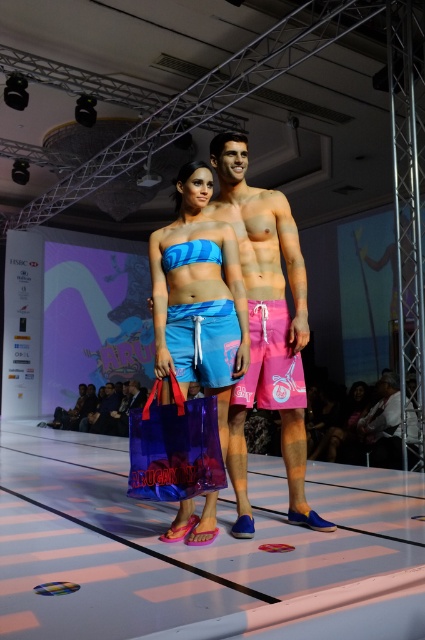
Question: Estimate the real-world distances between objects in this image. Which object is farther from the pink fabric shorts at right?

Choices:
 (A) pink matte swim shorts at center
 (B) blue fabric shorts at center

Answer: (B)

Question: Is pink matte swim shorts at center bigger than blue fabric shorts at center?

Choices:
 (A) yes
 (B) no

Answer: (A)

Question: Is transparent purple shopping bag at center wider than pink fabric shorts at right?

Choices:
 (A) yes
 (B) no

Answer: (A)

Question: Where is pink matte swim shorts at center located in relation to pink fabric shorts at right in the image?

Choices:
 (A) below
 (B) above

Answer: (B)

Question: Which of these objects is positioned closest to the pink matte swim shorts at center?

Choices:
 (A) blue fabric shorts at center
 (B) pink fabric shorts at right
 (C) transparent purple shopping bag at center
 (D) blue matte swimsuit at center

Answer: (B)

Question: Considering the real-world distances, which object is farthest from the pink fabric shorts at right?

Choices:
 (A) blue fabric shorts at center
 (B) blue matte swimsuit at center
 (C) pink matte swim shorts at center
 (D) transparent purple shopping bag at center

Answer: (D)